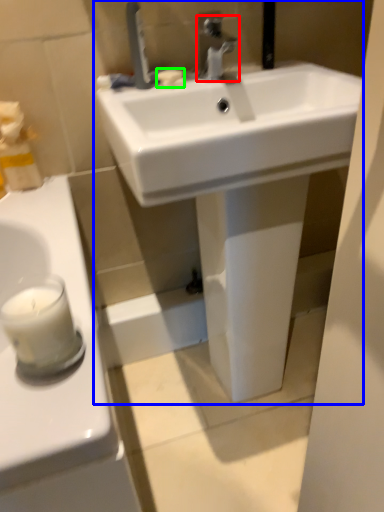
Question: Considering the real-world distances, which object is farthest from tap (highlighted by a red box)? sink (highlighted by a blue box) or soap (highlighted by a green box)?

Choices:
 (A) sink
 (B) soap

Answer: (A)